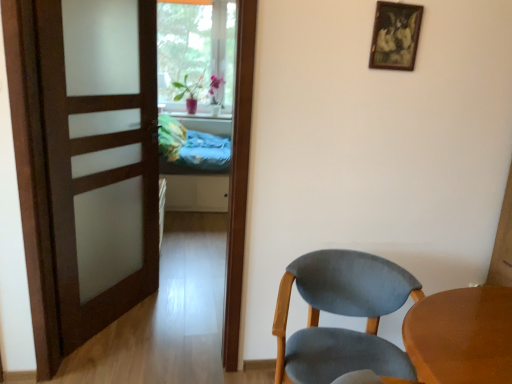
Question: Considering the relative sizes of blue fabric bed at center and satin wood door at left in the image provided, is blue fabric bed at center thinner than satin wood door at left?

Choices:
 (A) yes
 (B) no

Answer: (B)

Question: Considering the relative sizes of blue fabric bed at center and satin wood door at left in the image provided, is blue fabric bed at center taller than satin wood door at left?

Choices:
 (A) yes
 (B) no

Answer: (B)

Question: From a real-world perspective, is blue fabric bed at center positioned under satin wood door at left based on gravity?

Choices:
 (A) no
 (B) yes

Answer: (B)

Question: Does blue fabric bed at center come in front of satin wood door at left?

Choices:
 (A) no
 (B) yes

Answer: (A)

Question: Is blue fabric bed at center positioned with its back to satin wood door at left?

Choices:
 (A) no
 (B) yes

Answer: (A)

Question: From a real-world perspective, is blue fabric bed at center positioned over satin wood door at left based on gravity?

Choices:
 (A) no
 (B) yes

Answer: (A)

Question: From the image's perspective, is blue fabric bed at center over light blue fabric chair at lower right?

Choices:
 (A) yes
 (B) no

Answer: (A)

Question: Is the position of blue fabric bed at center less distant than that of light blue fabric chair at lower right?

Choices:
 (A) yes
 (B) no

Answer: (B)

Question: Considering the relative sizes of blue fabric bed at center and light blue fabric chair at lower right in the image provided, is blue fabric bed at center smaller than light blue fabric chair at lower right?

Choices:
 (A) no
 (B) yes

Answer: (A)

Question: Is blue fabric bed at center taller than light blue fabric chair at lower right?

Choices:
 (A) no
 (B) yes

Answer: (B)

Question: From the image's perspective, would you say blue fabric bed at center is shown under light blue fabric chair at lower right?

Choices:
 (A) no
 (B) yes

Answer: (A)

Question: Is blue fabric bed at center facing away from light blue fabric chair at lower right?

Choices:
 (A) no
 (B) yes

Answer: (A)

Question: Does light blue fabric chair at lower right come behind blue fabric bed at center?

Choices:
 (A) yes
 (B) no

Answer: (B)